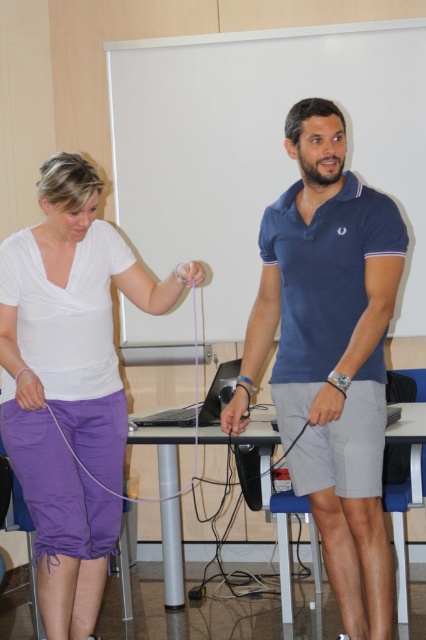
You are standing in the room where the two people are demonstrating with a long object. You want to take a photo of the point at coordinate point [299,298] without moving any objects. What is the minimum distance you need to move forward or backward to ensure the point is in focus? Assume your camera has a depth of field that can sharply focus objects within a 2 meter range centered at 2.5 meters from the camera.

The point at coordinate point [299,298] is 2.36 meters away from the camera. Since the depth of field is centered at 2.5 meters with a 2 meter range, the focus range spans from 2.0 meters to 3.0 meters. Since 2.36 meters falls within this range, no adjustment is needed. The point is already within the focus range.

You are an observer in the room where the two people are demonstrating with the object. You need to determine which of the two points, point (256, 308) or point (296, 257), is closer to you. Which one is closer?

Point (256, 308) is closer to you because it is further to the viewer than point (296, 257).